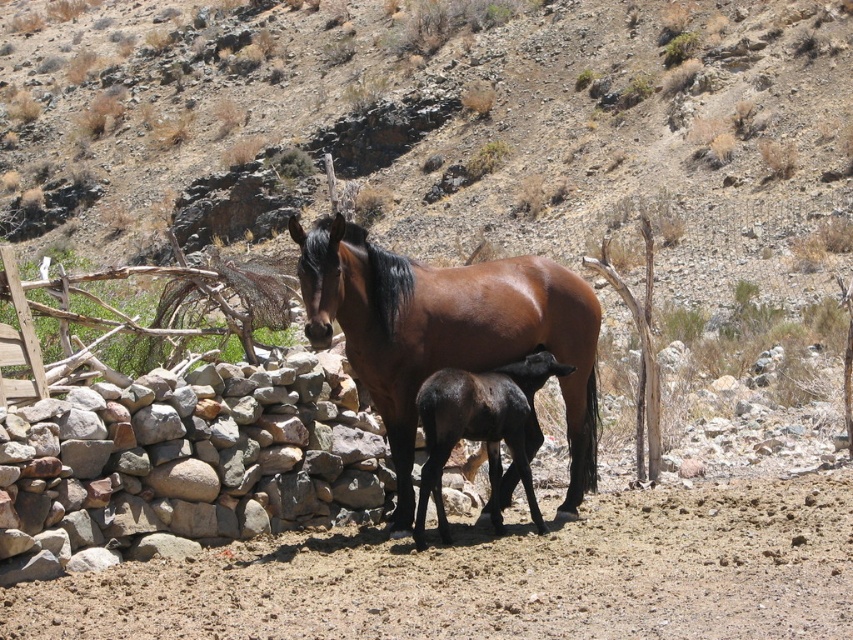
Question: Is brown dirt field at center above black glossy foal at center?

Choices:
 (A) yes
 (B) no

Answer: (B)

Question: Considering the relative positions of gray rough stone at lower left and brown glossy horse at center in the image provided, where is gray rough stone at lower left located with respect to brown glossy horse at center?

Choices:
 (A) left
 (B) right

Answer: (B)

Question: Which object is the closest to the gray rough stone at lower left?

Choices:
 (A) black glossy foal at center
 (B) brown glossy horse at center
 (C) brown dirt field at center

Answer: (B)

Question: Observing the image, what is the correct spatial positioning of brown dirt field at center in reference to black glossy foal at center?

Choices:
 (A) right
 (B) left

Answer: (A)

Question: Which of the following is the closest to the observer?

Choices:
 (A) (209, 524)
 (B) (438, 461)
 (C) (589, 307)

Answer: (B)

Question: Which is nearer to the black glossy foal at center?

Choices:
 (A) brown dirt field at center
 (B) brown glossy horse at center
 (C) gray rough stone at lower left

Answer: (B)